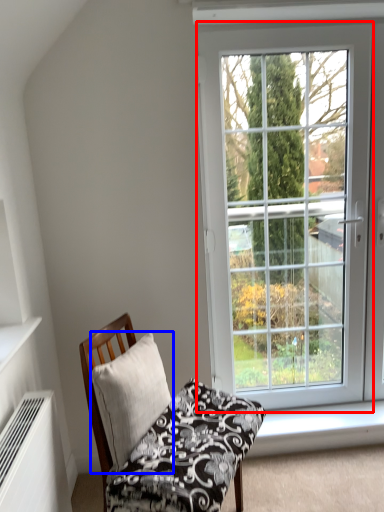
Question: Which of the following is the closest to the observer, window (highlighted by a red box) or pillow (highlighted by a blue box)?

Choices:
 (A) window
 (B) pillow

Answer: (B)